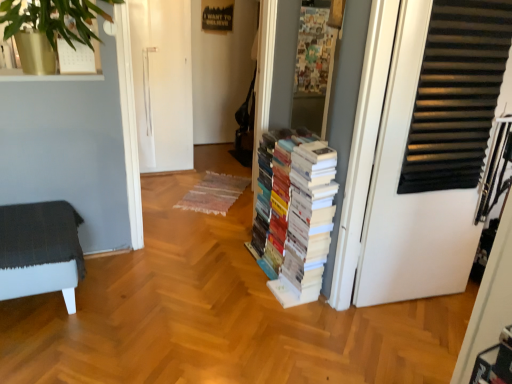
Question: Does dark gray fabric ottoman at left lie behind white matte door at right?

Choices:
 (A) no
 (B) yes

Answer: (B)

Question: Does dark gray fabric ottoman at left appear on the left side of white matte door at right?

Choices:
 (A) no
 (B) yes

Answer: (B)

Question: Can you confirm if dark gray fabric ottoman at left is shorter than white matte door at right?

Choices:
 (A) no
 (B) yes

Answer: (B)

Question: Is dark gray fabric ottoman at left at the right side of white matte door at right?

Choices:
 (A) no
 (B) yes

Answer: (A)

Question: From a real-world perspective, is dark gray fabric ottoman at left beneath white matte door at right?

Choices:
 (A) yes
 (B) no

Answer: (A)

Question: From the image's perspective, would you say dark gray fabric ottoman at left is positioned over white matte door at right?

Choices:
 (A) yes
 (B) no

Answer: (B)

Question: Can you confirm if white matte door at right is taller than white paper books at center?

Choices:
 (A) no
 (B) yes

Answer: (B)

Question: Is white matte door at right placed right next to white paper books at center?

Choices:
 (A) yes
 (B) no

Answer: (B)

Question: From the image's perspective, is white matte door at right on white paper books at center?

Choices:
 (A) no
 (B) yes

Answer: (B)

Question: Can you confirm if white matte door at right is bigger than white paper books at center?

Choices:
 (A) yes
 (B) no

Answer: (B)

Question: From a real-world perspective, is white matte door at right beneath white paper books at center?

Choices:
 (A) yes
 (B) no

Answer: (B)

Question: Is white paper books at center at the back of white matte door at right?

Choices:
 (A) no
 (B) yes

Answer: (A)

Question: Is white paper books at center positioned beyond the bounds of white matte door at right?

Choices:
 (A) no
 (B) yes

Answer: (B)